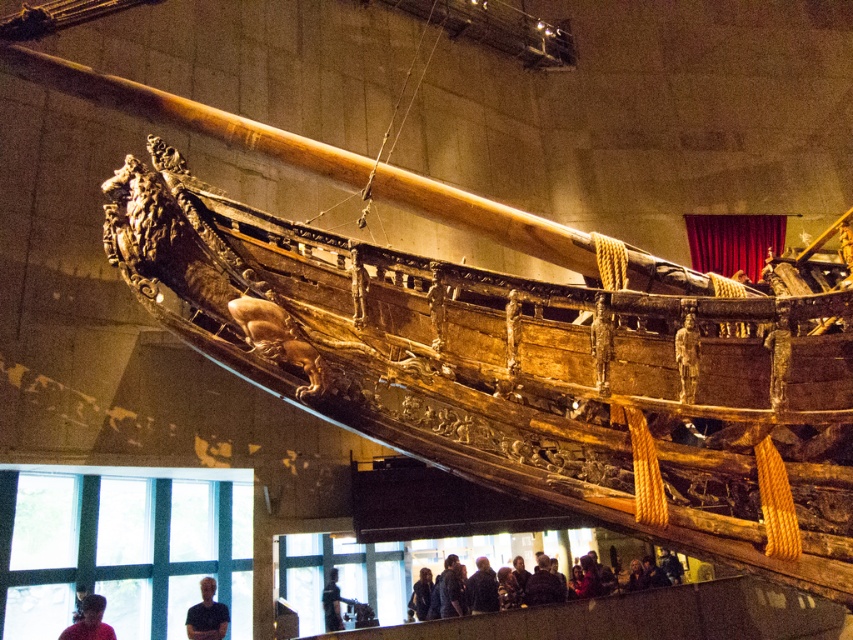
Is dark blue shirt at lower left positioned behind dark gray fabric jacket at lower center?

No, dark blue shirt at lower left is in front of dark gray fabric jacket at lower center.

Where is `dark blue shirt at lower left`? The image size is (853, 640). dark blue shirt at lower left is located at coordinates (206, 614).

Describe the element at coordinates (206, 614) in the screenshot. The width and height of the screenshot is (853, 640). I see `dark blue shirt at lower left` at that location.

I want to click on dark blue shirt at lower left, so click(206, 614).

Between dark brown leather jacket at lower center and dark blue shirt at lower left, which one is positioned lower?

dark brown leather jacket at lower center is lower down.

Does dark brown leather jacket at lower center appear on the right side of dark blue shirt at lower left?

Indeed, dark brown leather jacket at lower center is positioned on the right side of dark blue shirt at lower left.

Is point (483, 604) less distant than point (212, 636)?

That is False.

This screenshot has width=853, height=640. In order to click on dark brown leather jacket at lower center in this screenshot , I will do `click(548, 582)`.

Can you confirm if dark brown leather jacket at lower center is wider than red fabric person at lower left?

Yes.

Locate an element on the screen. The height and width of the screenshot is (640, 853). dark brown leather jacket at lower center is located at coordinates (548, 582).